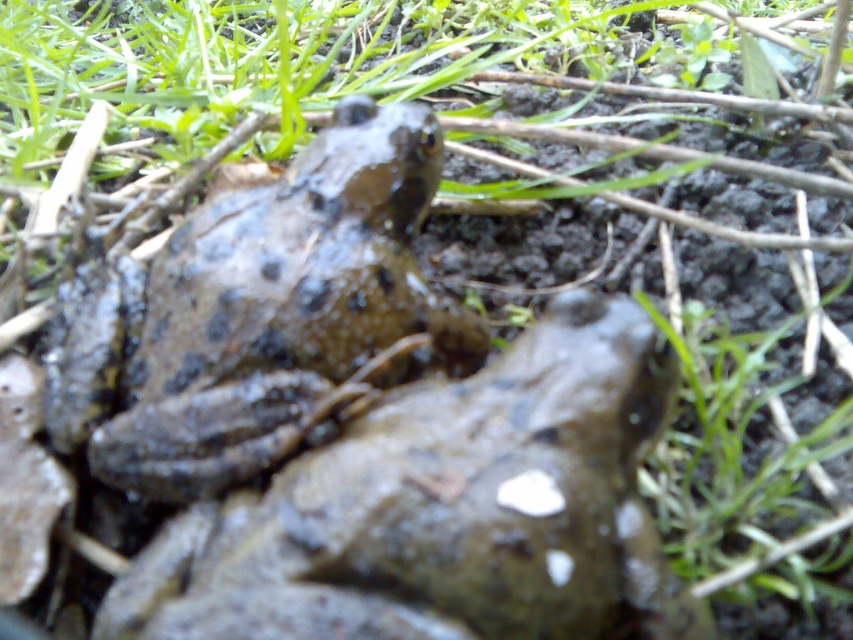
Question: From the image, what is the correct spatial relationship of speckled mud frog at center in relation to muddy skin frog at center?

Choices:
 (A) right
 (B) left

Answer: (A)

Question: Can you confirm if speckled mud frog at center is thinner than muddy skin frog at center?

Choices:
 (A) yes
 (B) no

Answer: (B)

Question: Among these points, which one is nearest to the camera?

Choices:
 (A) (323, 541)
 (B) (155, 348)

Answer: (A)

Question: Which point appears farthest from the camera in this image?

Choices:
 (A) (445, 589)
 (B) (401, 230)

Answer: (B)

Question: Among these points, which one is farthest from the camera?

Choices:
 (A) (598, 340)
 (B) (338, 202)

Answer: (B)

Question: Is speckled mud frog at center to the right of muddy skin frog at center from the viewer's perspective?

Choices:
 (A) no
 (B) yes

Answer: (B)